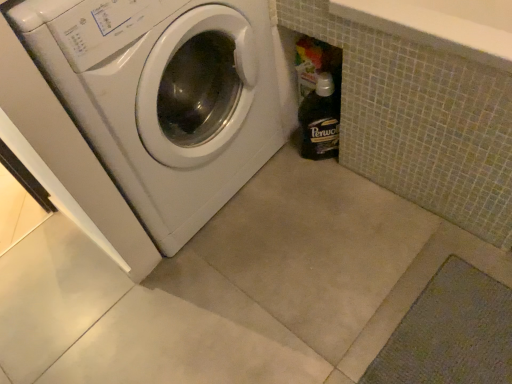
Where is `free space in front of black glass bottle at lower right`? This screenshot has height=384, width=512. free space in front of black glass bottle at lower right is located at coordinates pyautogui.click(x=334, y=188).